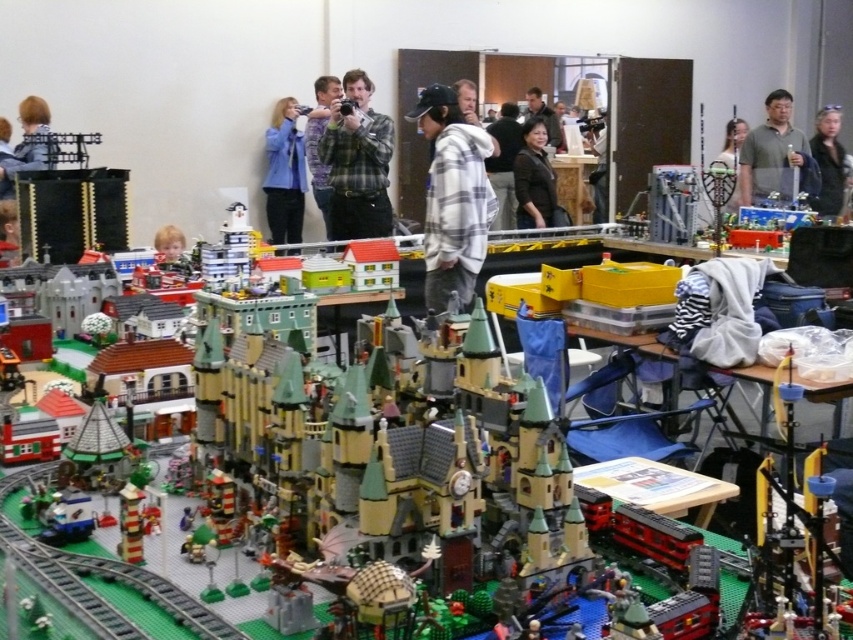
You are standing in the LEGO exhibition and notice the dark brown leather jacket at center. Where exactly is it positioned in relation to the castle model?

The dark brown leather jacket at center is located at point coordinates of 0.284 on the x and 0.628 on the y axis.

You are a photographer standing at the back of the room. You want to take a photo of the dark brown leather jacket at center and the smooth plastic head at center. What is the minimum distance you need to move forward to ensure both subjects are in focus?

The minimum distance you need to move forward is 1.74 meters to ensure both the dark brown leather jacket at center and the smooth plastic head at center are in focus since they are 1.74 meters apart.

You are a photographer at the LEGO exhibition and need to capture both the matte blue jacket at upper center and the white plaid shirt at center in a single frame. Which person should you position closer to the camera to ensure both are fully visible?

The matte blue jacket at upper center is narrower than the white plaid shirt at center, so positioning the white plaid shirt at center closer to the camera will allow both to fit within the frame since it takes up more space.